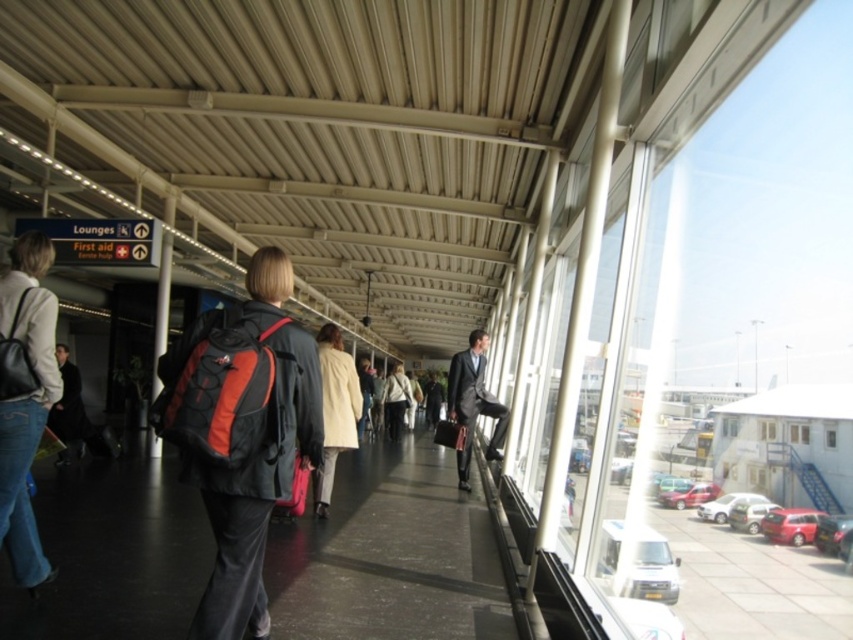
Image resolution: width=853 pixels, height=640 pixels. What do you see at coordinates (24, 397) in the screenshot? I see `denim jacket at left` at bounding box center [24, 397].

Which of these two, denim jacket at left or matte black suit at center, stands shorter?

With less height is denim jacket at left.

At what (x,y) coordinates should I click in order to perform the action: click on denim jacket at left. Please return your answer as a coordinate pair (x, y). This screenshot has height=640, width=853. Looking at the image, I should click on (24, 397).

Does light beige coat at center have a lesser height compared to light beige jacket at center?

No, light beige coat at center is not shorter than light beige jacket at center.

Is light beige coat at center to the left of light beige jacket at center from the viewer's perspective?

Indeed, light beige coat at center is positioned on the left side of light beige jacket at center.

Between point (360, 396) and point (395, 396), which one is positioned behind?

Point (395, 396)

Where is `light beige coat at center`? The height and width of the screenshot is (640, 853). light beige coat at center is located at coordinates (335, 410).

Is denim jacket at left to the left of light beige coat at center from the viewer's perspective?

Yes, denim jacket at left is to the left of light beige coat at center.

Consider the image. Which is below, denim jacket at left or light beige coat at center?

light beige coat at center

Where is `denim jacket at left`? denim jacket at left is located at coordinates (24, 397).

Locate an element on the screen. denim jacket at left is located at coordinates (24, 397).